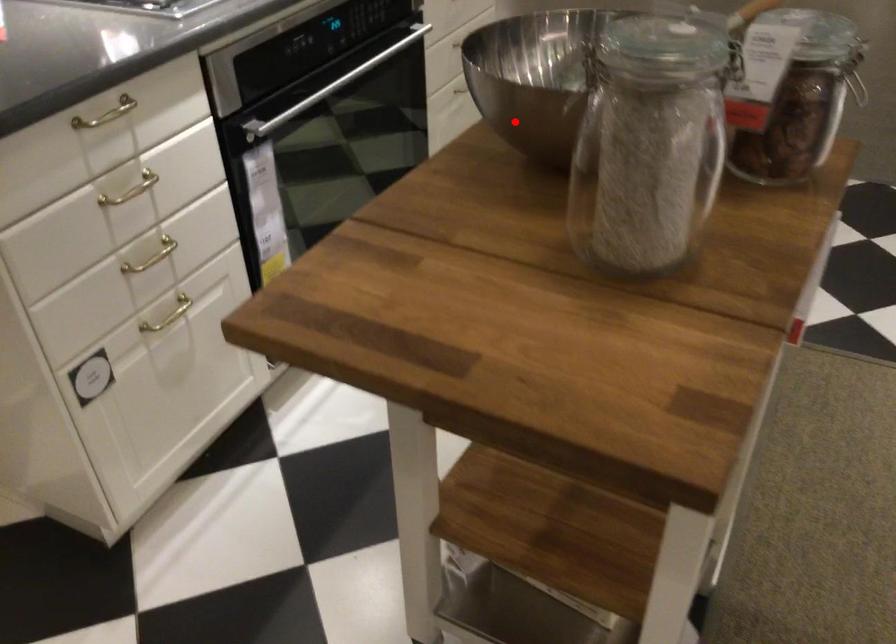
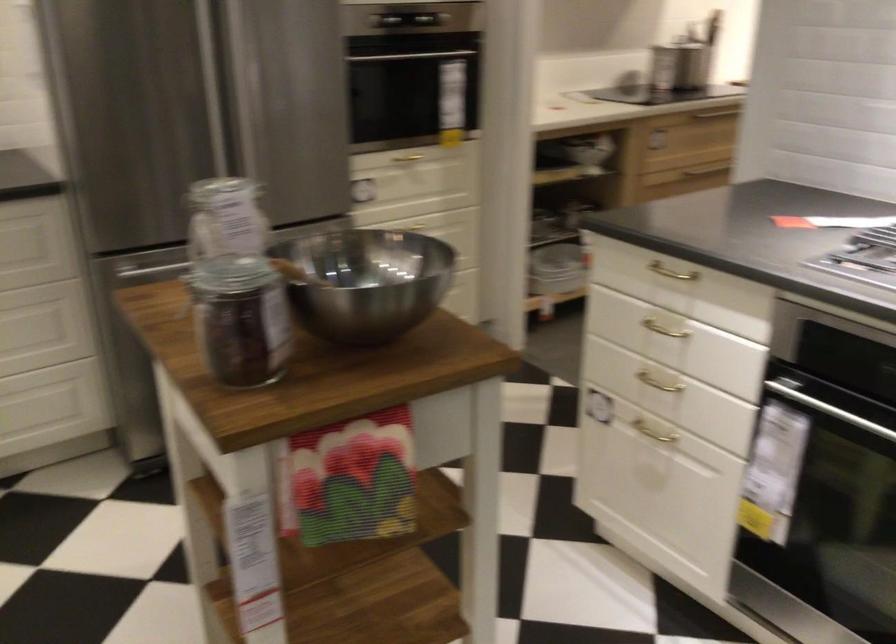
Question: I am providing you with two images of the same scene from different viewpoints. Given a red point in image1, look at the same physical point in image2. Is it:

Choices:
 (A) Closer to the viewpoint
 (B) Farther from the viewpoint

Answer: (B)